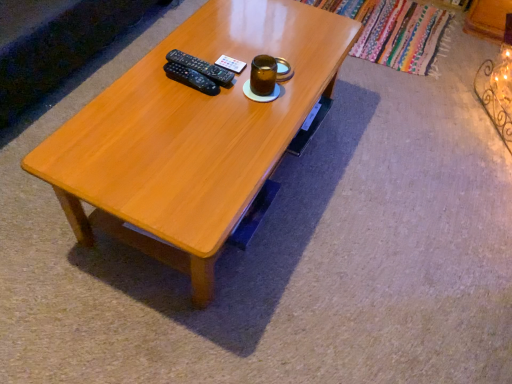
The height and width of the screenshot is (384, 512). I want to click on unoccupied area in front of black plastic remote at center, so click(x=184, y=110).